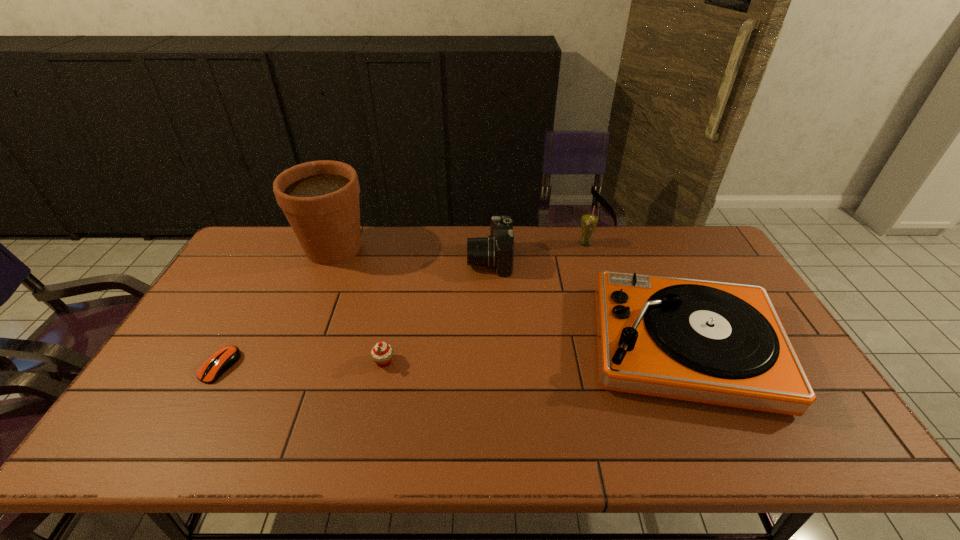
Where is `blank region between the second object from left to right and the record player`? The image size is (960, 540). blank region between the second object from left to right and the record player is located at coordinates (509, 297).

Where is `vacant area that lies between the shortest object and the third object from right to left`? vacant area that lies between the shortest object and the third object from right to left is located at coordinates (355, 313).

Identify the location of free space between the third object from left to right and the straw for drinking. This screenshot has height=540, width=960. (485, 302).

The width and height of the screenshot is (960, 540). I want to click on vacant space that is in between the computer mouse and the camera, so click(x=355, y=313).

This screenshot has height=540, width=960. I want to click on free space that is in between the shortest object and the straw for drinking, so click(402, 305).

Locate an element on the screen. The height and width of the screenshot is (540, 960). vacant space in between the third object from left to right and the leftmost object is located at coordinates (302, 364).

At what (x,y) coordinates should I click in order to perform the action: click on free area in between the record player and the fourth object from left to right. Please return your answer as a coordinate pair (x, y). Image resolution: width=960 pixels, height=540 pixels. Looking at the image, I should click on (587, 302).

Locate an element on the screen. unoccupied area between the third object from right to left and the record player is located at coordinates (587, 302).

Image resolution: width=960 pixels, height=540 pixels. In order to click on free space between the flowerpot and the record player in this screenshot , I will do `click(509, 297)`.

Locate an element on the screen. The height and width of the screenshot is (540, 960). free space between the flowerpot and the leftmost object is located at coordinates (276, 307).